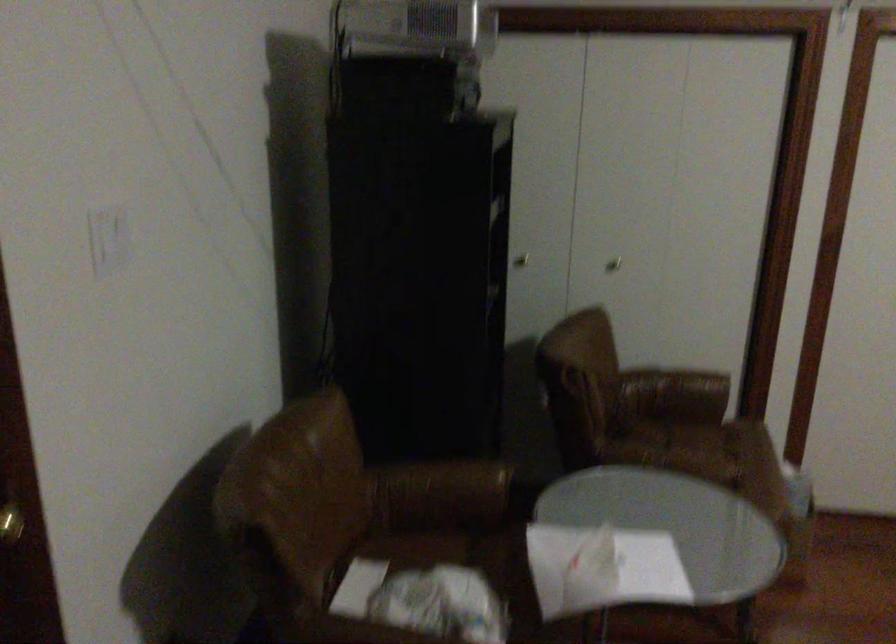
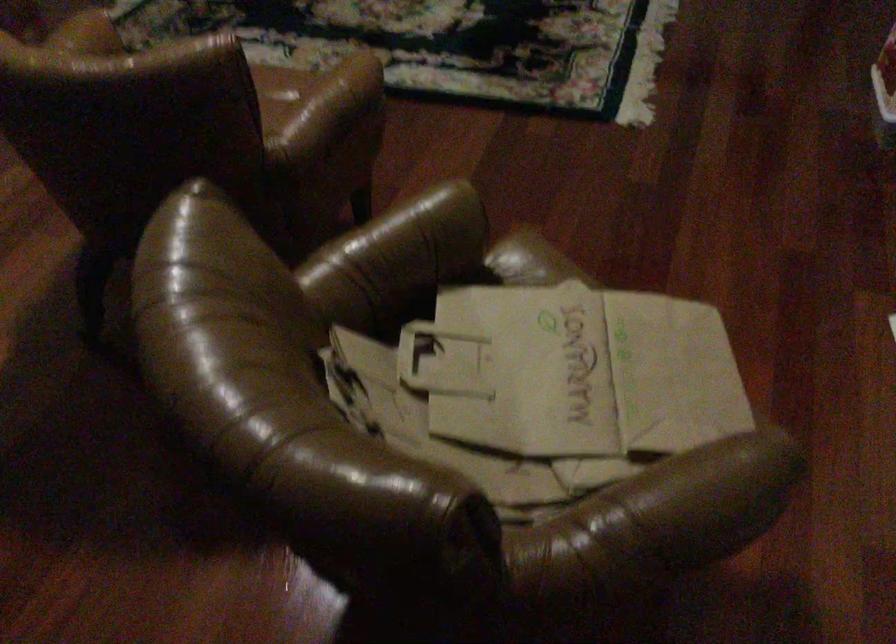
First-person continuous shooting, in which direction is the camera rotating?

The camera rotated toward right-down.